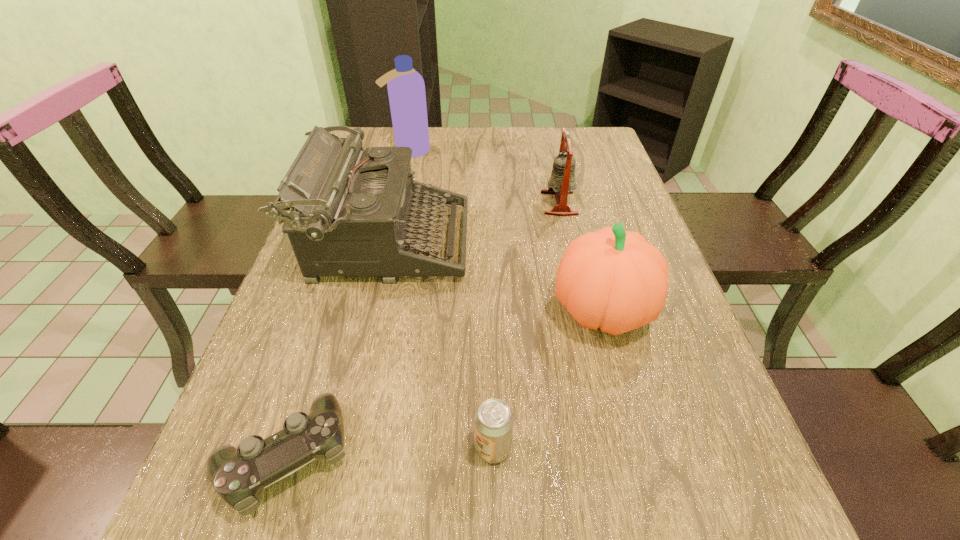
Where is `free space that is in between the typewriter and the bell`? This screenshot has width=960, height=540. free space that is in between the typewriter and the bell is located at coordinates (473, 223).

At what (x,y) coordinates should I click in order to perform the action: click on vacant space in between the control and the third object from right to left. Please return your answer as a coordinate pair (x, y). Looking at the image, I should click on (389, 451).

Identify which object is located as the nearest to the farthest object. Please provide its 2D coordinates. Your answer should be formatted as a tuple, i.e. [(x, y)], where the tuple contains the x and y coordinates of a point satisfying the conditions above.

[(353, 212)]

Point out which object is positioned as the fourth nearest to the bell. Please provide its 2D coordinates. Your answer should be formatted as a tuple, i.e. [(x, y)], where the tuple contains the x and y coordinates of a point satisfying the conditions above.

[(493, 421)]

Where is `blank space that satisfies the following two spatial constraints: 1. on the front side of the shampoo; 2. on the right side of the fourth object from left to right`? Image resolution: width=960 pixels, height=540 pixels. blank space that satisfies the following two spatial constraints: 1. on the front side of the shampoo; 2. on the right side of the fourth object from left to right is located at coordinates (339, 448).

Find the location of a particular element. free point that satisfies the following two spatial constraints: 1. on the typing side of the beer can; 2. on the left side of the typewriter is located at coordinates (340, 448).

At what (x,y) coordinates should I click in order to perform the action: click on free region that satisfies the following two spatial constraints: 1. on the typing side of the typewriter; 2. on the right side of the fifth tallest object. Please return your answer as a coordinate pair (x, y). The height and width of the screenshot is (540, 960). Looking at the image, I should click on (340, 448).